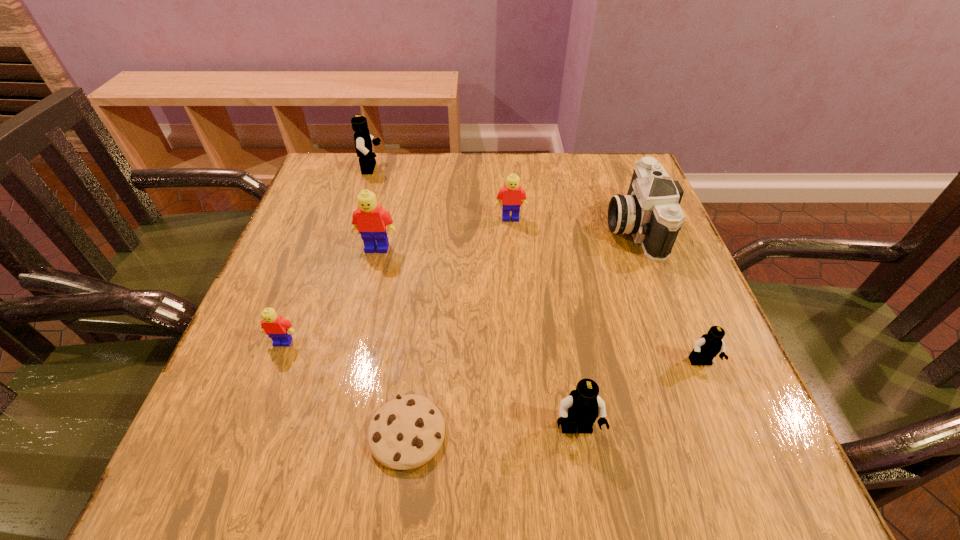
The image size is (960, 540). I want to click on the fourth farthest Lego, so [278, 329].

Locate an element on the screen. the rightmost black Lego is located at coordinates (709, 345).

Where is `the second farthest black Lego`? This screenshot has width=960, height=540. the second farthest black Lego is located at coordinates (709, 345).

Where is `the shortest object`? the shortest object is located at coordinates (405, 433).

Where is `cookie`? cookie is located at coordinates (405, 433).

Locate an element on the screen. Image resolution: width=960 pixels, height=540 pixels. vacant space located on the front-facing side of the leftmost black Lego is located at coordinates (530, 168).

At what (x,y) coordinates should I click in order to perform the action: click on free space located 0.210m on the front-facing side of the second yellow Lego from right to left. Please return your answer as a coordinate pair (x, y). Looking at the image, I should click on (357, 331).

I want to click on vacant region located 0.290m on the front of the black camera, so click(x=692, y=381).

Find the location of a particular element. vacant region located 0.170m on the front-facing side of the second farthest Lego is located at coordinates (515, 274).

Identify the location of vacant area located on the front-facing side of the smallest yellow Lego. Image resolution: width=960 pixels, height=540 pixels. (258, 409).